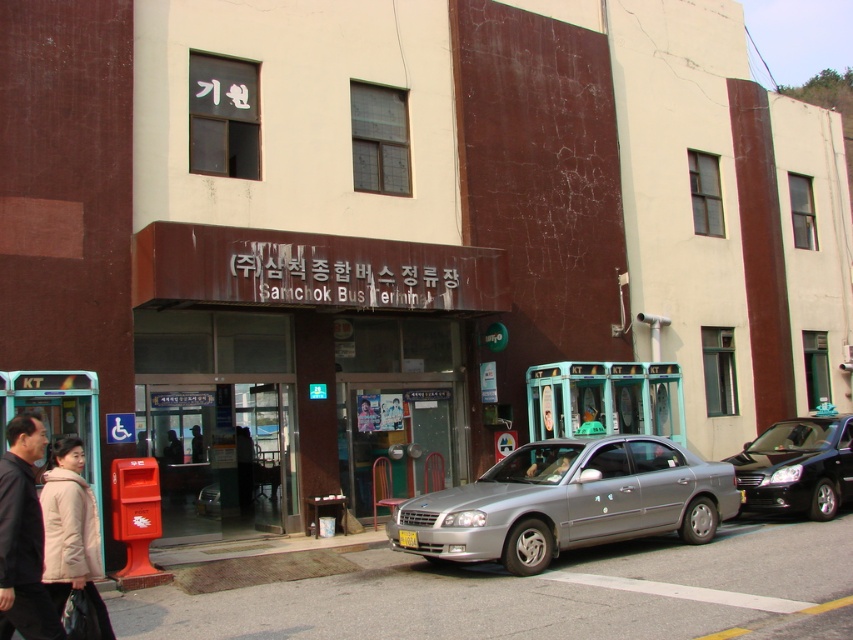
Does shiny black sedan at center appear on the right side of black matte jacket at lower left?

Correct, you'll find shiny black sedan at center to the right of black matte jacket at lower left.

Can you confirm if shiny black sedan at center is positioned to the left of black matte jacket at lower left?

Incorrect, shiny black sedan at center is not on the left side of black matte jacket at lower left.

Is point (761, 508) closer to viewer compared to point (41, 611)?

No, it is behind (41, 611).

This screenshot has height=640, width=853. I want to click on shiny black sedan at center, so click(798, 467).

Between silver metallic sedan at center and shiny black sedan at center, which one is positioned lower?

shiny black sedan at center is lower down.

Who is more forward, (x=676, y=460) or (x=828, y=426)?

Point (x=676, y=460)

At what (x,y) coordinates should I click in order to perform the action: click on silver metallic sedan at center. Please return your answer as a coordinate pair (x, y). Looking at the image, I should click on (567, 502).

Who is positioned more to the right, silver metallic sedan at center or green plastic man at center?

green plastic man at center is more to the right.

Does silver metallic sedan at center appear on the right side of green plastic man at center?

No, silver metallic sedan at center is not to the right of green plastic man at center.

Is point (527, 449) closer to viewer compared to point (590, 406)?

Yes.

Find the location of a particular element. silver metallic sedan at center is located at coordinates (567, 502).